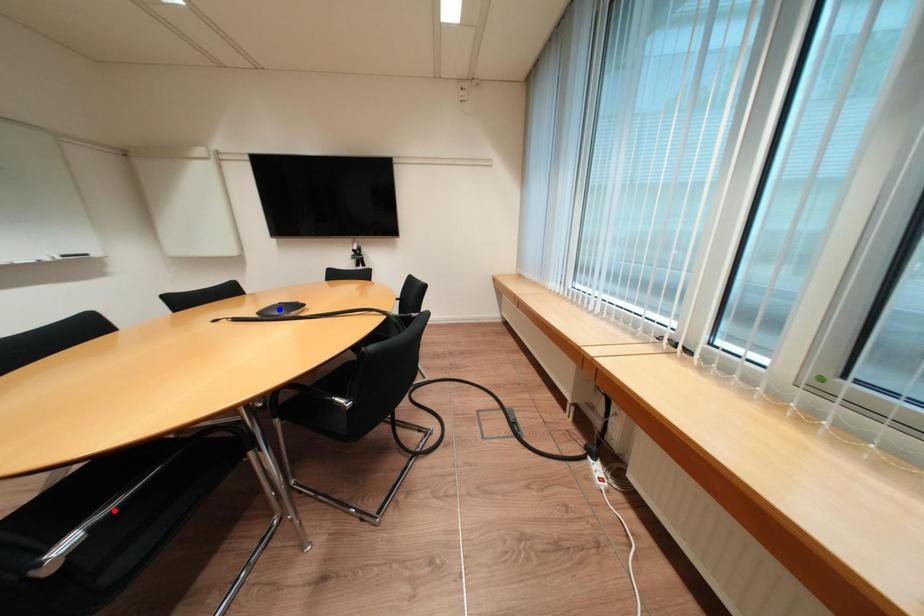
Question: In the image, two points are highlighted. Which point is nearer to the camera? Reply with the corresponding letter.

Choices:
 (A) blue point
 (B) red point

Answer: (B)